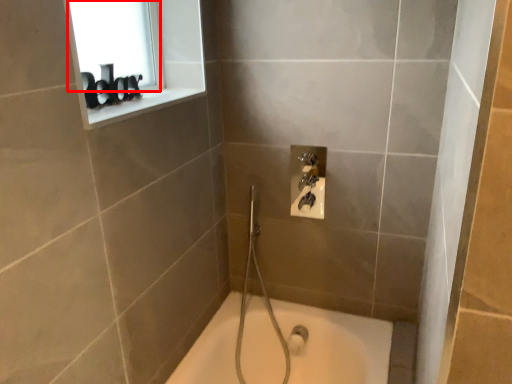
Question: From the image, what is the correct spatial relationship of window screen (annotated by the red box) in relation to window sill?

Choices:
 (A) left
 (B) right

Answer: (A)